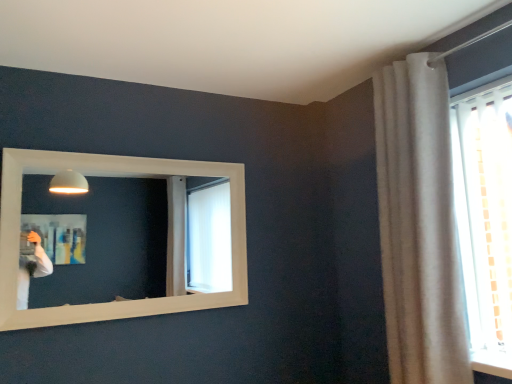
What are the coordinates of `white textured curtain at upper right` in the screenshot? It's located at (418, 224).

The image size is (512, 384). Describe the element at coordinates (418, 224) in the screenshot. I see `white textured curtain at upper right` at that location.

The width and height of the screenshot is (512, 384). Describe the element at coordinates (124, 238) in the screenshot. I see `white wooden mirror at upper left` at that location.

Locate an element on the screen. white wooden mirror at upper left is located at coordinates (124, 238).

The width and height of the screenshot is (512, 384). Identify the location of white textured curtain at upper right. (418, 224).

Is white textured curtain at upper right to the left of white wooden mirror at upper left from the viewer's perspective?

→ No, white textured curtain at upper right is not to the left of white wooden mirror at upper left.

Which object is further away from the camera, white textured curtain at upper right or white wooden mirror at upper left?

white wooden mirror at upper left is more distant.

Considering the points (436, 290) and (106, 238), which point is behind, point (436, 290) or point (106, 238)?

The point (106, 238) is farther from the camera.

From the image's perspective, is white textured curtain at upper right under white wooden mirror at upper left?

No.

From a real-world perspective, who is located higher, white textured curtain at upper right or white wooden mirror at upper left?

white wooden mirror at upper left.

Does white textured curtain at upper right have a lesser width compared to white wooden mirror at upper left?

Incorrect, the width of white textured curtain at upper right is not less than that of white wooden mirror at upper left.

Is white textured curtain at upper right taller than white wooden mirror at upper left?

Correct, white textured curtain at upper right is much taller as white wooden mirror at upper left.

Is white textured curtain at upper right smaller than white wooden mirror at upper left?

No.

Is white wooden mirror at upper left completely or partially inside white textured curtain at upper right?

No, white wooden mirror at upper left is not inside white textured curtain at upper right.

Consider the image. Would you say white textured curtain at upper right is a long distance from white wooden mirror at upper left?

That's right, there is a large distance between white textured curtain at upper right and white wooden mirror at upper left.

Is white textured curtain at upper right facing away from white wooden mirror at upper left?

white textured curtain at upper right is not turned away from white wooden mirror at upper left.

Measure the distance between white textured curtain at upper right and white wooden mirror at upper left.

white textured curtain at upper right is 3.39 meters from white wooden mirror at upper left.

Locate an element on the screen. The height and width of the screenshot is (384, 512). mirror located below the white textured curtain at upper right (from the image's perspective) is located at coordinates (124, 238).

Considering the relative positions of white wooden mirror at upper left and white textured curtain at upper right in the image provided, is white wooden mirror at upper left to the left or to the right of white textured curtain at upper right?

white wooden mirror at upper left is positioned on white textured curtain at upper right's left side.

Is white wooden mirror at upper left further to the viewer compared to white textured curtain at upper right?

That is True.

Does point (65, 264) lie in front of point (448, 158)?

No.

From the image's perspective, between white wooden mirror at upper left and white textured curtain at upper right, which one is located above?

white textured curtain at upper right.

From a real-world perspective, who is located lower, white wooden mirror at upper left or white textured curtain at upper right?

white textured curtain at upper right.

Is white wooden mirror at upper left wider than white textured curtain at upper right?

Incorrect, the width of white wooden mirror at upper left does not surpass that of white textured curtain at upper right.

In terms of height, does white wooden mirror at upper left look taller or shorter compared to white textured curtain at upper right?

white wooden mirror at upper left is shorter than white textured curtain at upper right.

In the scene shown: Between white wooden mirror at upper left and white textured curtain at upper right, which one has larger size?

With larger size is white textured curtain at upper right.

Can we say white wooden mirror at upper left lies outside white textured curtain at upper right?

white wooden mirror at upper left is positioned outside white textured curtain at upper right.

Is white wooden mirror at upper left in contact with white textured curtain at upper right?

No, white wooden mirror at upper left is not in contact with white textured curtain at upper right.

Is white wooden mirror at upper left oriented away from white textured curtain at upper right?

white wooden mirror at upper left does not have its back to white textured curtain at upper right.

What's the angular difference between white wooden mirror at upper left and white textured curtain at upper right's facing directions?

The angular difference between white wooden mirror at upper left and white textured curtain at upper right is 90.2 degrees.

This screenshot has height=384, width=512. I want to click on curtain located above the white wooden mirror at upper left (from the image's perspective), so click(x=418, y=224).

At what (x,y) coordinates should I click in order to perform the action: click on curtain located above the white wooden mirror at upper left (from the image's perspective). Please return your answer as a coordinate pair (x, y). This screenshot has width=512, height=384. Looking at the image, I should click on (418, 224).

At what (x,y) coordinates should I click in order to perform the action: click on curtain beneath the white wooden mirror at upper left (from a real-world perspective). Please return your answer as a coordinate pair (x, y). The image size is (512, 384). Looking at the image, I should click on (418, 224).